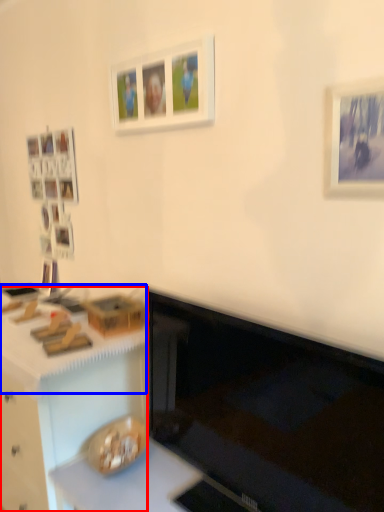
Question: Which point is further to the camera, desk (highlighted by a red box) or counter top (highlighted by a blue box)?

Choices:
 (A) desk
 (B) counter top

Answer: (A)